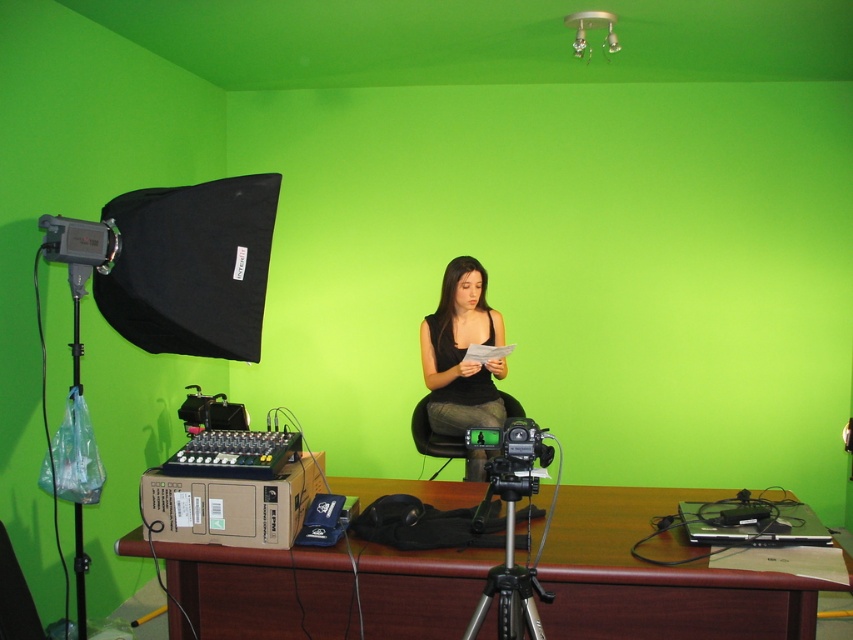
Consider the image. Does brown wooden table at center appear on the right side of silver metallic tripod at center?

No, brown wooden table at center is not to the right of silver metallic tripod at center.

Looking at this image, is brown wooden table at center thinner than silver metallic tripod at center?

In fact, brown wooden table at center might be wider than silver metallic tripod at center.

I want to click on brown wooden table at center, so click(x=657, y=577).

Which is more to the right, brown wooden table at center or black matte dress at center?

brown wooden table at center is more to the right.

In the scene shown: Can you confirm if brown wooden table at center is positioned to the right of black matte dress at center?

Indeed, brown wooden table at center is positioned on the right side of black matte dress at center.

Is point (767, 609) more distant than point (462, 276)?

No, (767, 609) is closer to viewer.

In order to click on brown wooden table at center in this screenshot , I will do `click(657, 577)`.

Does point (461, 420) come behind point (521, 483)?

Yes, point (461, 420) is farther from viewer.

Which is more to the left, black matte dress at center or silver metallic tripod at center?

black matte dress at center

The width and height of the screenshot is (853, 640). What do you see at coordinates (461, 353) in the screenshot?
I see `black matte dress at center` at bounding box center [461, 353].

Image resolution: width=853 pixels, height=640 pixels. I want to click on black matte dress at center, so click(x=461, y=353).